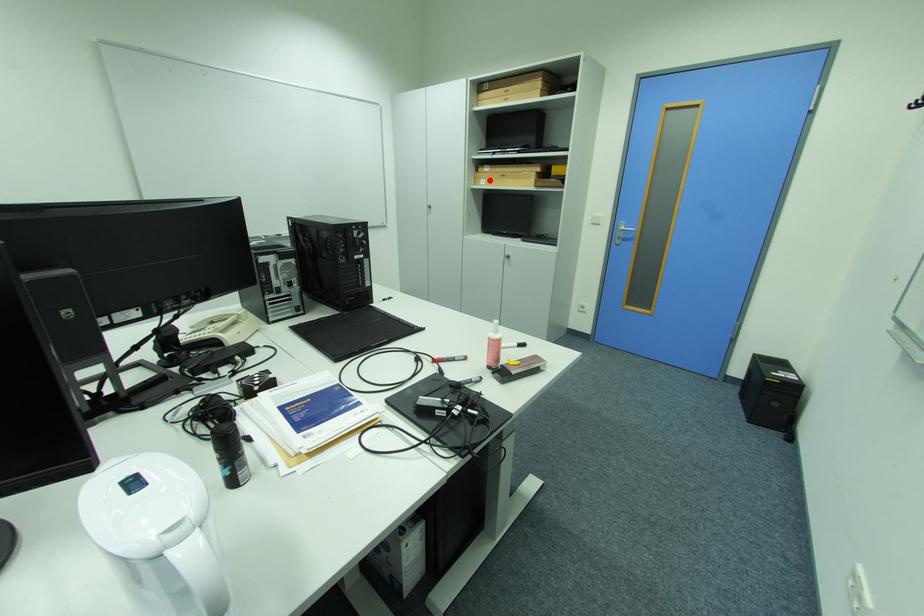
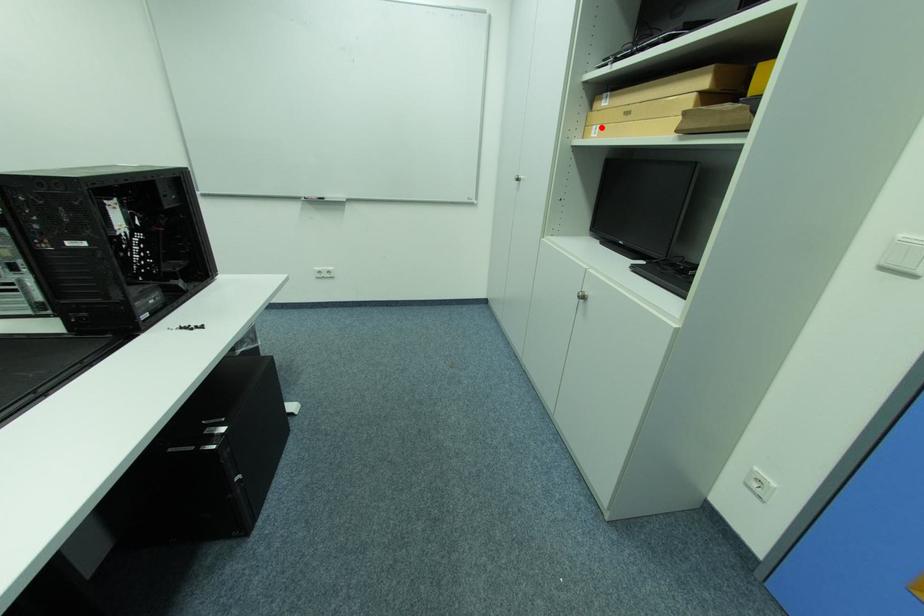
I am providing you with two images of the same scene from different viewpoints. A red point is marked on the first image and another point is marked on the second image. Does the point marked in image1 correspond to the same location as the one in image2?

Yes